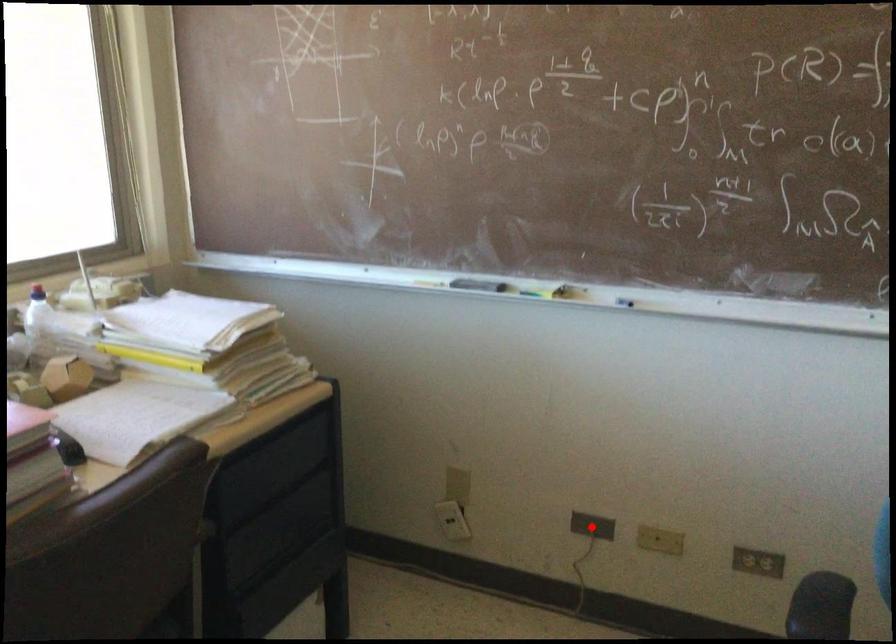
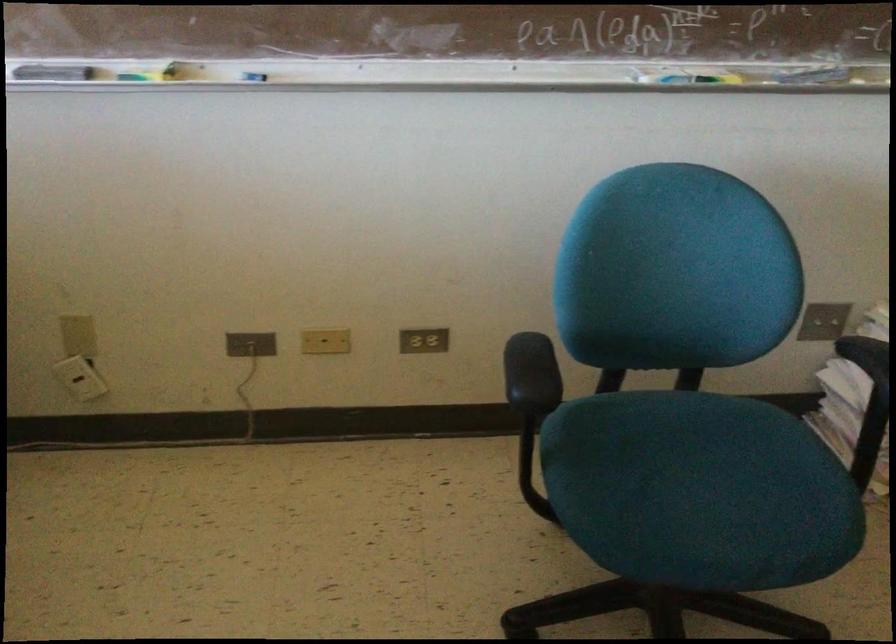
The point at the highlighted location is marked in the first image. Where is the corresponding point in the second image?

(250, 344)